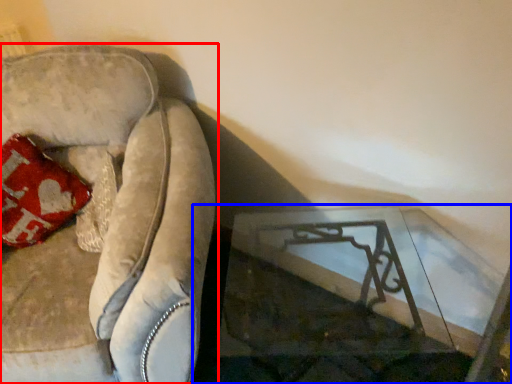
Question: Which of the following is the farthest to the observer, furniture (highlighted by a red box) or table (highlighted by a blue box)?

Choices:
 (A) furniture
 (B) table

Answer: (A)